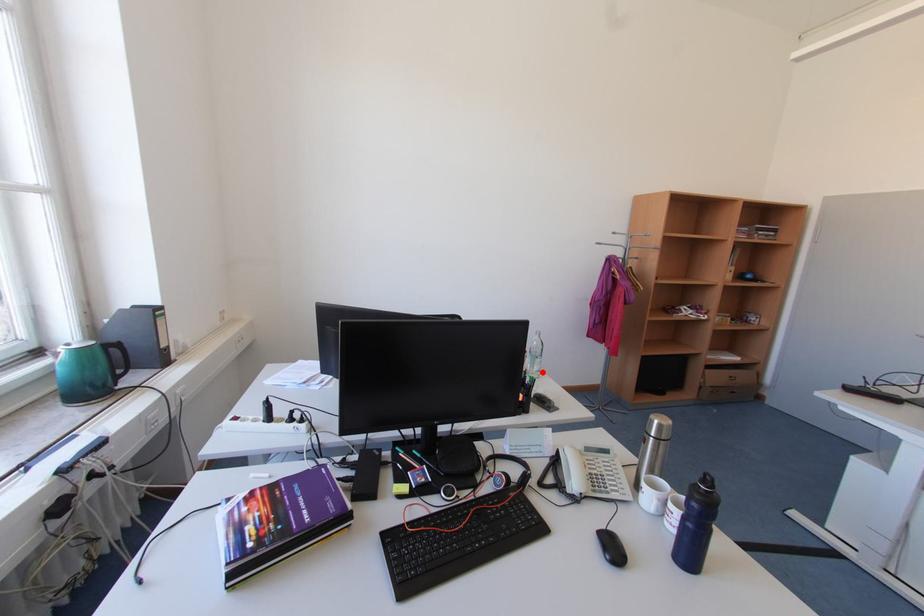
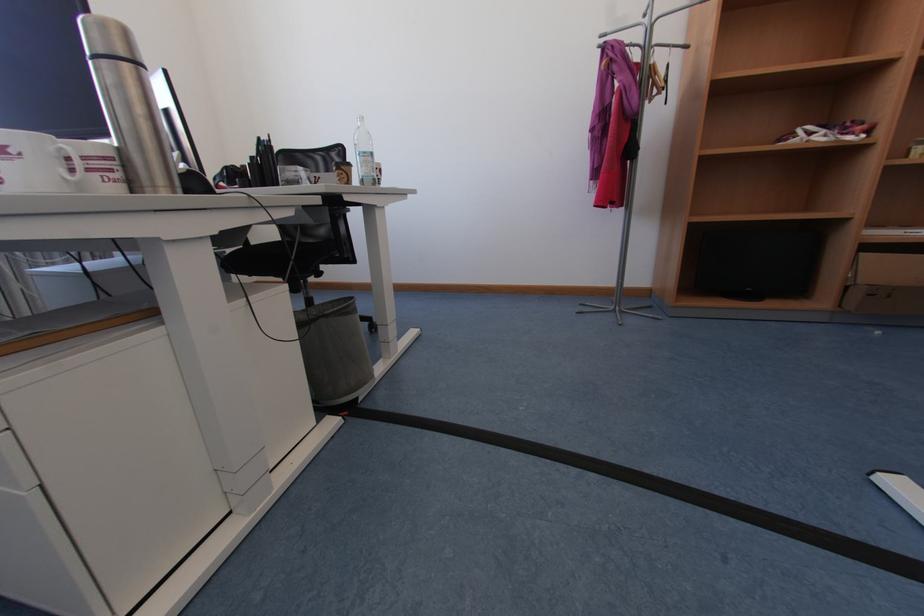
In the second image, find the point that corresponds to the highlighted location in the first image.

(369, 177)